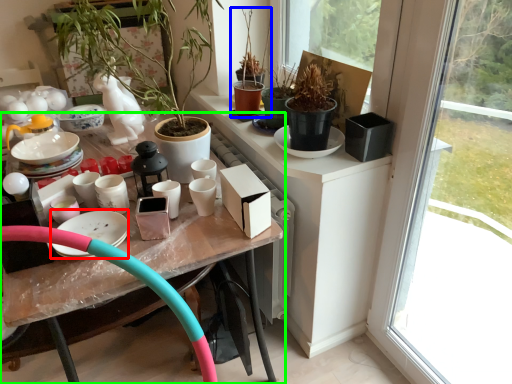
Question: Which object is the closest to the tableware (highlighted by a red box)? Choose among these: houseplant (highlighted by a blue box) or table (highlighted by a green box).

Choices:
 (A) houseplant
 (B) table

Answer: (B)